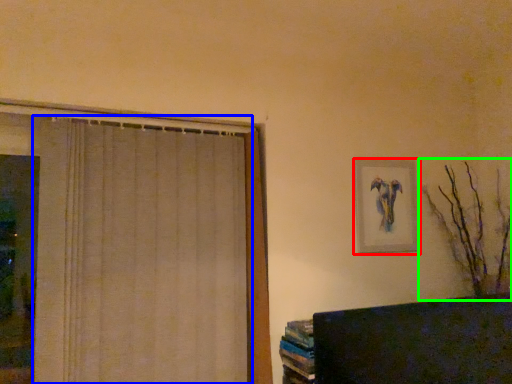
Question: Which object is the closest to the picture frame (highlighted by a red box)? Choose among these: curtain (highlighted by a blue box) or branch (highlighted by a green box).

Choices:
 (A) curtain
 (B) branch

Answer: (B)